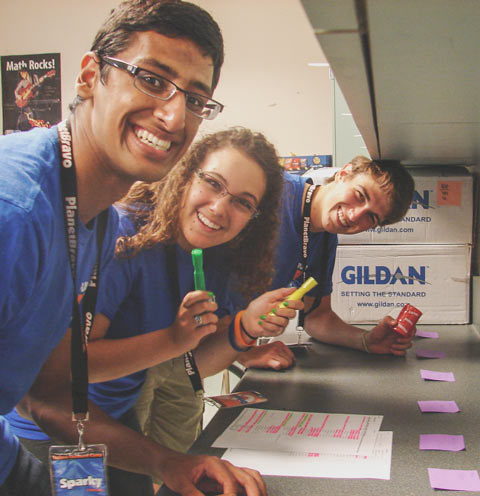
I want to click on grey counter top, so click(x=363, y=389).